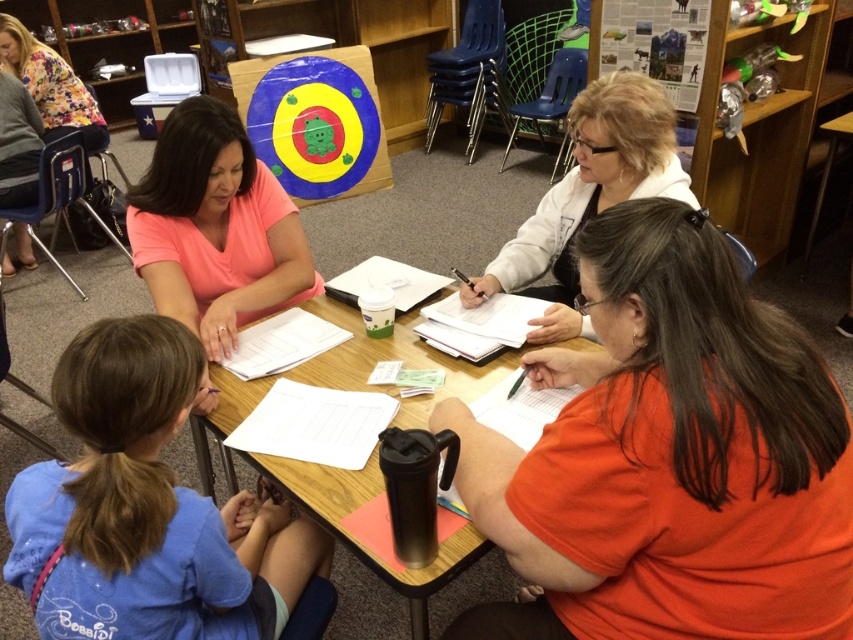
Find the location of a particular element. The width and height of the screenshot is (853, 640). orange matte shirt at center is located at coordinates (668, 458).

Is point (682, 280) closer to camera compared to point (340, 324)?

Yes, it is.

Which is behind, point (657, 280) or point (277, 461)?

The point (277, 461) is more distant.

This screenshot has height=640, width=853. What are the coordinates of `orange matte shirt at center` in the screenshot? It's located at (668, 458).

Is point (315, 572) less distant than point (177, 138)?

Yes, it is in front of point (177, 138).

Is the position of blue cotton shirt at lower left less distant than that of pink matte shirt at upper left?

That is True.

Who is more distant from viewer, (289, 572) or (251, 282)?

Positioned behind is point (251, 282).

Locate an element on the screen. This screenshot has width=853, height=640. blue cotton shirt at lower left is located at coordinates (151, 512).

Looking at this image, can you confirm if pink matte shirt at upper left is shorter than white fleece jacket at upper center?

Yes.

Measure the distance between pink matte shirt at upper left and white fleece jacket at upper center.

The distance of pink matte shirt at upper left from white fleece jacket at upper center is 27.02 inches.

Is point (166, 301) farther from camera compared to point (554, 214)?

That is False.

At what (x,y) coordinates should I click in order to perform the action: click on pink matte shirt at upper left. Please return your answer as a coordinate pair (x, y). The width and height of the screenshot is (853, 640). Looking at the image, I should click on (215, 227).